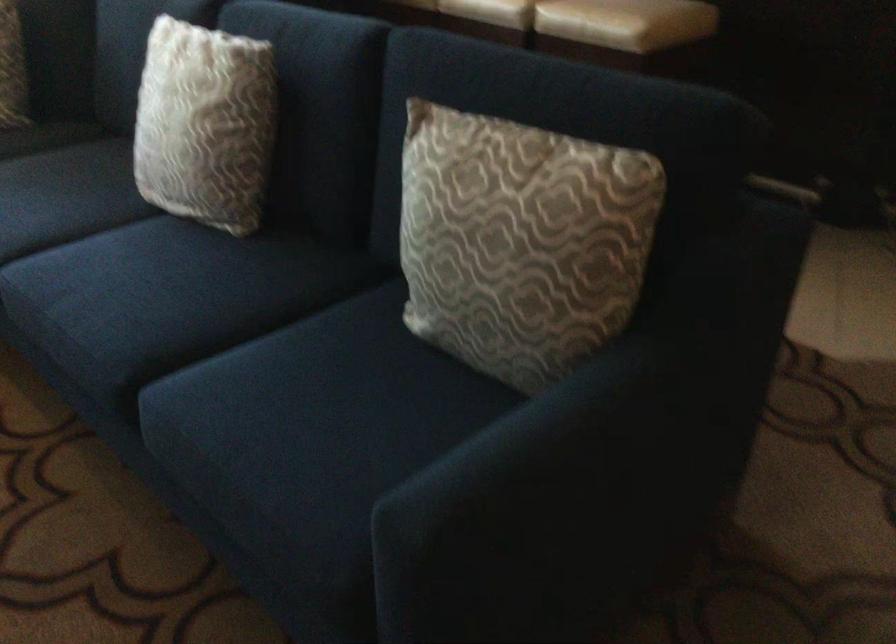
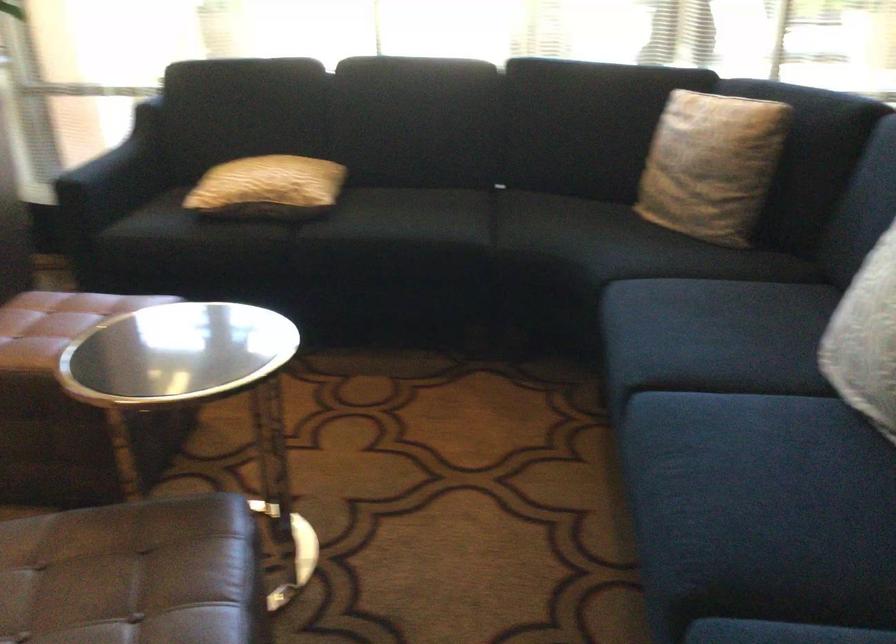
Where in the second image is the point corresponding to pixel 119 281 from the first image?

(745, 459)